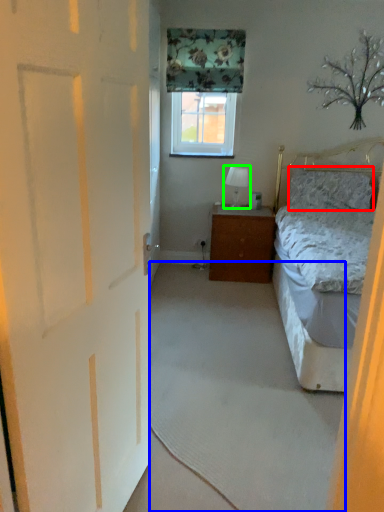
Question: Which object is positioned closest to pillow (highlighted by a red box)? Select from plain (highlighted by a blue box) and table lamp (highlighted by a green box).

Choices:
 (A) plain
 (B) table lamp

Answer: (B)